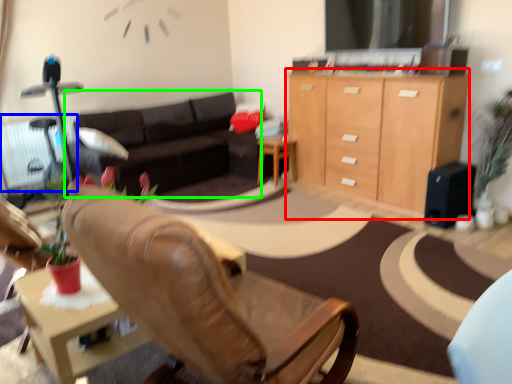
Question: Estimate the real-world distances between objects in this image. Which object is farther from cabinetry (highlighted by a red box), radiator (highlighted by a blue box) or studio couch (highlighted by a green box)?

Choices:
 (A) radiator
 (B) studio couch

Answer: (A)